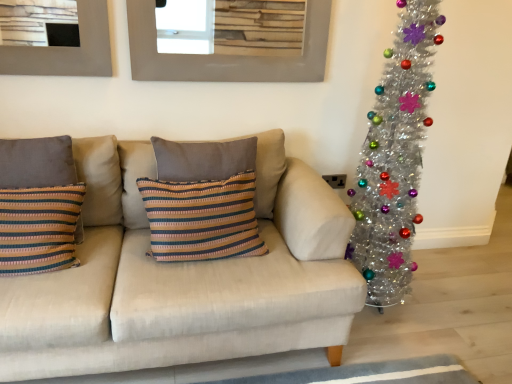
The width and height of the screenshot is (512, 384). In order to click on striped fabric cushion at center, placed as the 1th pillow when sorted from right to left in this screenshot , I will do `click(135, 179)`.

What are the coordinates of `striped fabric cushion at left, arranged as the first pillow when viewed from the left` in the screenshot? It's located at (37, 162).

The image size is (512, 384). Identify the location of beige fabric couch at center. (184, 273).

Describe the element at coordinates (184, 273) in the screenshot. This screenshot has height=384, width=512. I see `beige fabric couch at center` at that location.

At what (x,y) coordinates should I click in order to perform the action: click on striped fabric cushion at center, placed as the 1th pillow when sorted from right to left. Please return your answer as a coordinate pair (x, y). Looking at the image, I should click on (135, 179).

Image resolution: width=512 pixels, height=384 pixels. In order to click on the 1st pillow above the beige fabric couch at center (from a real-world perspective) in this screenshot , I will do `click(37, 162)`.

Does striped fabric cushion at left, arranged as the first pillow when viewed from the left, contain beige fabric couch at center?

No.

Considering the sizes of objects striped fabric cushion at left, arranged as the first pillow when viewed from the left, and beige fabric couch at center in the image provided, who is taller, striped fabric cushion at left, arranged as the first pillow when viewed from the left, or beige fabric couch at center?

Standing taller between the two is beige fabric couch at center.

Considering the sizes of objects striped fabric cushion at left, the 2th pillow when ordered from right to left, and beige fabric couch at center in the image provided, who is smaller, striped fabric cushion at left, the 2th pillow when ordered from right to left, or beige fabric couch at center?

With smaller size is striped fabric cushion at left, the 2th pillow when ordered from right to left.

From the image's perspective, is beige fabric couch at center below shiny silver christmas tree at right?

Yes, from the image's perspective, beige fabric couch at center is beneath shiny silver christmas tree at right.

Visually, is beige fabric couch at center positioned to the left or to the right of shiny silver christmas tree at right?

beige fabric couch at center is to the left of shiny silver christmas tree at right.

At what (x,y) coordinates should I click in order to perform the action: click on studio couch that is under the shiny silver christmas tree at right (from a real-world perspective). Please return your answer as a coordinate pair (x, y). This screenshot has height=384, width=512. Looking at the image, I should click on click(x=184, y=273).

In terms of width, does matte gray picture frame at upper center look wider or thinner when compared to striped fabric cushion at left, the 2th pillow when ordered from right to left?

matte gray picture frame at upper center is thinner than striped fabric cushion at left, the 2th pillow when ordered from right to left.

Is matte gray picture frame at upper center positioned with its back to striped fabric cushion at left, arranged as the first pillow when viewed from the left?

No.

From a real-world perspective, which is physically below, matte gray picture frame at upper center or striped fabric cushion at left, arranged as the first pillow when viewed from the left?

striped fabric cushion at left, arranged as the first pillow when viewed from the left, is physically lower.

Would you say matte gray picture frame at upper center is inside or outside striped fabric cushion at left, arranged as the first pillow when viewed from the left?

matte gray picture frame at upper center is not inside striped fabric cushion at left, arranged as the first pillow when viewed from the left, it's outside.

From the image's perspective, is striped fabric cushion at center, placed as the 1th pillow when sorted from right to left, over beige fabric couch at center?

Yes, from the image's perspective, striped fabric cushion at center, placed as the 1th pillow when sorted from right to left, is over beige fabric couch at center.

Can you tell me how much striped fabric cushion at center, placed as the 1th pillow when sorted from right to left, and beige fabric couch at center differ in facing direction?

They differ by 0.00106 degrees in their facing directions.

Is the position of striped fabric cushion at center, placed as the 1th pillow when sorted from right to left, more distant than that of beige fabric couch at center?

Yes, striped fabric cushion at center, placed as the 1th pillow when sorted from right to left, is behind beige fabric couch at center.

Considering the positions of objects matte gray picture frame at upper center and beige fabric couch at center in the image provided, who is more to the left, matte gray picture frame at upper center or beige fabric couch at center?

From the viewer's perspective, beige fabric couch at center appears more on the left side.

Is matte gray picture frame at upper center outside of beige fabric couch at center?

Yes, matte gray picture frame at upper center is located beyond the bounds of beige fabric couch at center.

How far apart are matte gray picture frame at upper center and beige fabric couch at center?

matte gray picture frame at upper center and beige fabric couch at center are 31.25 inches apart from each other.

Considering the positions of objects matte gray picture frame at upper center and beige fabric couch at center in the image provided, who is behind, matte gray picture frame at upper center or beige fabric couch at center?

matte gray picture frame at upper center is further away from the camera.

Is striped fabric cushion at left, the 2th pillow when ordered from right to left, facing towards striped fabric cushion at center, placed as the 2th pillow when sorted from left to right?

No, striped fabric cushion at left, the 2th pillow when ordered from right to left, is not turned towards striped fabric cushion at center, placed as the 2th pillow when sorted from left to right.

Who is smaller, striped fabric cushion at left, arranged as the first pillow when viewed from the left, or striped fabric cushion at center, placed as the 2th pillow when sorted from left to right?

striped fabric cushion at left, arranged as the first pillow when viewed from the left.

Considering the positions of objects striped fabric cushion at left, the 2th pillow when ordered from right to left, and striped fabric cushion at center, placed as the 2th pillow when sorted from left to right, in the image provided, who is more to the right, striped fabric cushion at left, the 2th pillow when ordered from right to left, or striped fabric cushion at center, placed as the 2th pillow when sorted from left to right,?

From the viewer's perspective, striped fabric cushion at center, placed as the 2th pillow when sorted from left to right, appears more on the right side.

Is striped fabric cushion at left, arranged as the first pillow when viewed from the left, far from striped fabric cushion at center, placed as the 1th pillow when sorted from right to left?

No, striped fabric cushion at left, arranged as the first pillow when viewed from the left, is not far away from striped fabric cushion at center, placed as the 1th pillow when sorted from right to left.

Would you say beige fabric couch at center is outside matte gray picture frame at upper center?

Yes, beige fabric couch at center is not within matte gray picture frame at upper center.

From the image's perspective, is beige fabric couch at center positioned above or below matte gray picture frame at upper center?

beige fabric couch at center is situated lower than matte gray picture frame at upper center in the image.

Are beige fabric couch at center and matte gray picture frame at upper center making contact?

No, beige fabric couch at center is not beside matte gray picture frame at upper center.

From a real-world perspective, is beige fabric couch at center beneath matte gray picture frame at upper center?

Yes.

I want to click on studio couch that appears on the right of striped fabric cushion at left, the 2th pillow when ordered from right to left, so click(184, 273).

What are the coordinates of `studio couch in front of the shiny silver christmas tree at right` in the screenshot? It's located at (184, 273).

Which object lies further to the anchor point matte gray picture frame at upper center, shiny silver christmas tree at right or striped fabric cushion at left, the 2th pillow when ordered from right to left?

striped fabric cushion at left, the 2th pillow when ordered from right to left.

Which object lies further to the anchor point striped fabric cushion at left, the 2th pillow when ordered from right to left, shiny silver christmas tree at right or matte gray picture frame at upper center?

shiny silver christmas tree at right is further to striped fabric cushion at left, the 2th pillow when ordered from right to left.

Which object lies nearer to the anchor point beige fabric couch at center, striped fabric cushion at left, arranged as the first pillow when viewed from the left, or matte gray picture frame at upper center?

Based on the image, striped fabric cushion at left, arranged as the first pillow when viewed from the left, appears to be nearer to beige fabric couch at center.

Estimate the real-world distances between objects in this image. Which object is further from striped fabric cushion at left, the 2th pillow when ordered from right to left, beige fabric couch at center or matte gray picture frame at upper center?

matte gray picture frame at upper center lies further to striped fabric cushion at left, the 2th pillow when ordered from right to left, than the other object.

Looking at the image, which one is located closer to shiny silver christmas tree at right, beige fabric couch at center or striped fabric cushion at left, the 2th pillow when ordered from right to left?

beige fabric couch at center is closer to shiny silver christmas tree at right.

Which object lies nearer to the anchor point striped fabric cushion at left, the 2th pillow when ordered from right to left, shiny silver christmas tree at right or beige fabric couch at center?

Based on the image, beige fabric couch at center appears to be nearer to striped fabric cushion at left, the 2th pillow when ordered from right to left.

Looking at this image, when comparing their distances from striped fabric cushion at left, arranged as the first pillow when viewed from the left, does beige fabric couch at center or shiny silver christmas tree at right seem closer?

beige fabric couch at center is closer to striped fabric cushion at left, arranged as the first pillow when viewed from the left.

Estimate the real-world distances between objects in this image. Which object is further from matte gray picture frame at upper center, striped fabric cushion at center, placed as the 1th pillow when sorted from right to left, or beige fabric couch at center?

Based on the image, beige fabric couch at center appears to be further to matte gray picture frame at upper center.

The image size is (512, 384). Find the location of `picture frame between beige fabric couch at center and shiny silver christmas tree at right in the horizontal direction`. picture frame between beige fabric couch at center and shiny silver christmas tree at right in the horizontal direction is located at coordinates (225, 56).

You are a GUI agent. You are given a task and a screenshot of the screen. Output one action in this format:
    pyautogui.click(x=<x>, y=<y>)
    Task: Click on the pillow situated between striped fabric cushion at left, arranged as the first pillow when viewed from the left, and matte gray picture frame at upper center from left to right
    Image resolution: width=512 pixels, height=384 pixels.
    Given the screenshot: What is the action you would take?
    pyautogui.click(x=135, y=179)

The image size is (512, 384). Find the location of `pillow between striped fabric cushion at left, the 2th pillow when ordered from right to left, and shiny silver christmas tree at right, in the horizontal direction`. pillow between striped fabric cushion at left, the 2th pillow when ordered from right to left, and shiny silver christmas tree at right, in the horizontal direction is located at coordinates (135, 179).

Find the location of a particular element. picture frame between striped fabric cushion at left, the 2th pillow when ordered from right to left, and shiny silver christmas tree at right from left to right is located at coordinates (225, 56).